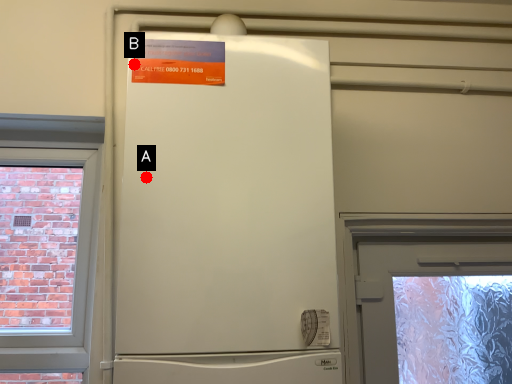
Question: Two points are circled on the image, labeled by A and B beside each circle. Which point is closer to the camera?

Choices:
 (A) A is closer
 (B) B is closer

Answer: (A)